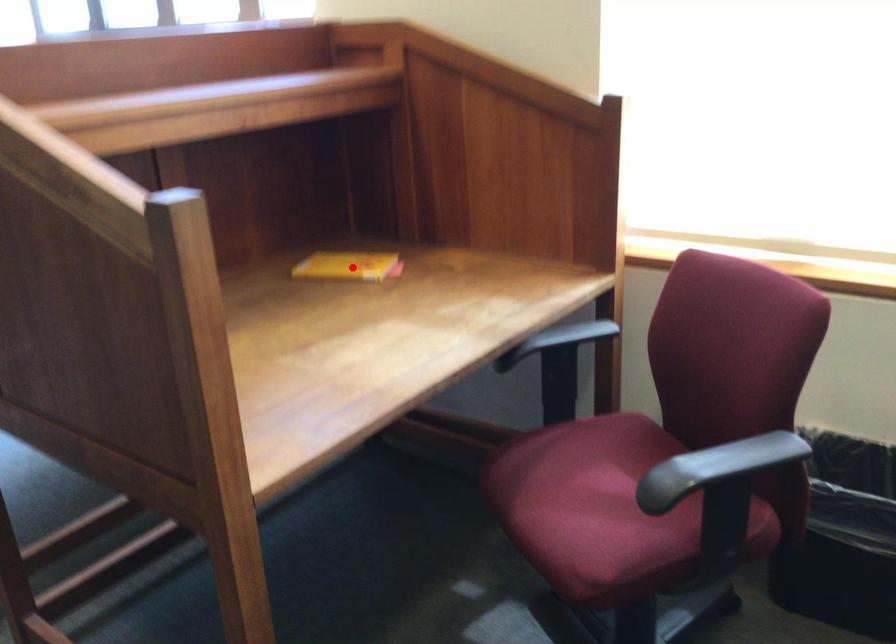
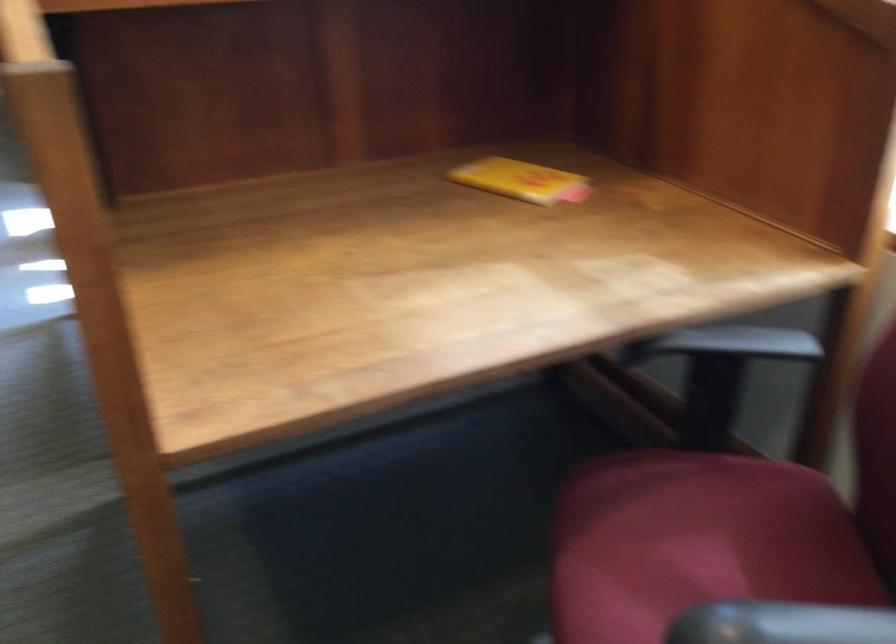
Where in the second image is the point corresponding to the highlighted location from the first image?

(521, 180)